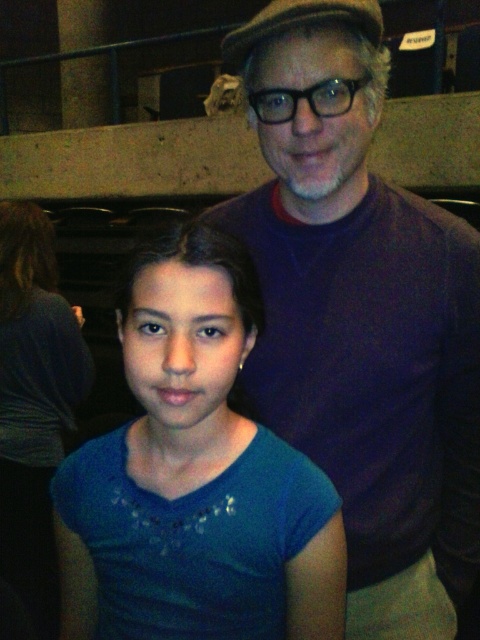
Measure the distance between purple sweater at upper right and camera.

26.78 inches

Is purple sweater at upper right positioned in front of blue cotton shirt at lower left?

Yes, it is in front of blue cotton shirt at lower left.

The image size is (480, 640). I want to click on purple sweater at upper right, so click(360, 317).

I want to click on purple sweater at upper right, so click(x=360, y=317).

Which is more to the left, purple sweater at upper right or blue fabric shirt at center?

From the viewer's perspective, blue fabric shirt at center appears more on the left side.

Looking at this image, between purple sweater at upper right and blue fabric shirt at center, which one has less height?

blue fabric shirt at center

This screenshot has width=480, height=640. Find the location of `purple sweater at upper right`. purple sweater at upper right is located at coordinates (360, 317).

Measure the distance between blue fabric shirt at center and camera.

57.29 centimeters

Locate an element on the screen. blue fabric shirt at center is located at coordinates (194, 476).